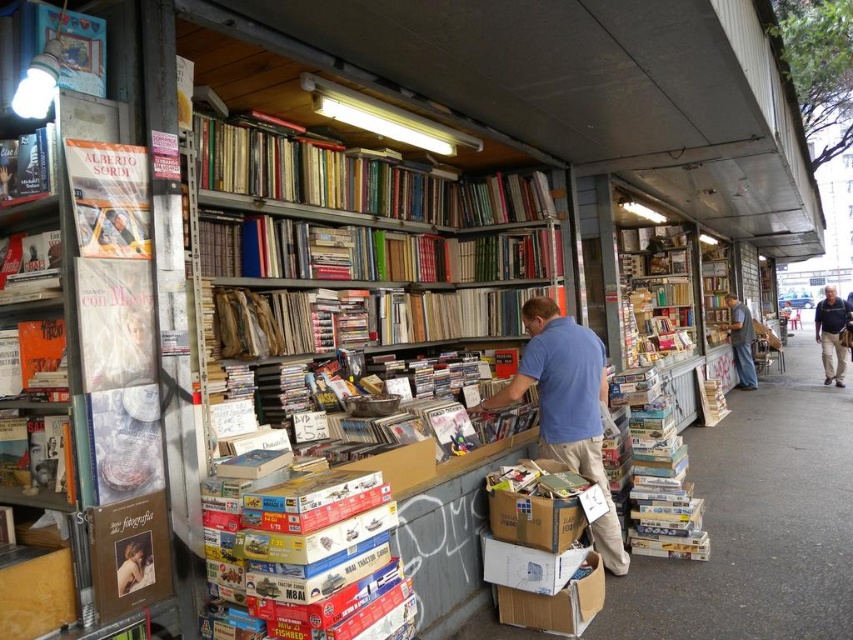
From the picture: You are a customer browsing in the outdoor bookshop. You notice a blue cotton shirt at center and some hardcover books at right. Which item takes up more space in terms of physical size?

The blue cotton shirt at center has a larger size compared to hardcover books at right, so the blue cotton shirt at center takes up more space.

You are a book collector who wants to place a new book on the shelf. You have two spots available between the hardcover books at upper center and the hardcover books at right. Which spot has more space for your new book?

The spot between the hardcover books at upper center and the hardcover books at right has more space because the hardcover books at upper center are wider than the hardcover books at right, creating a larger gap.